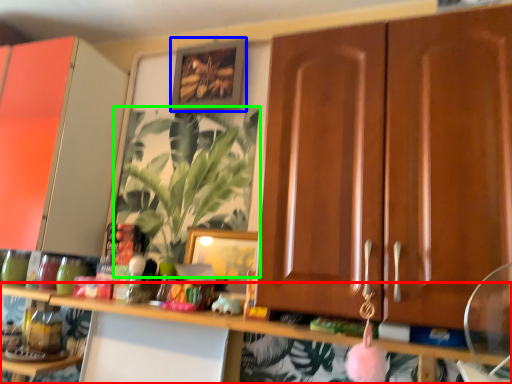
Question: Considering the real-world distances, which object is closest to shelf (highlighted by a red box)? picture frame (highlighted by a blue box) or houseplant (highlighted by a green box).

Choices:
 (A) picture frame
 (B) houseplant

Answer: (B)